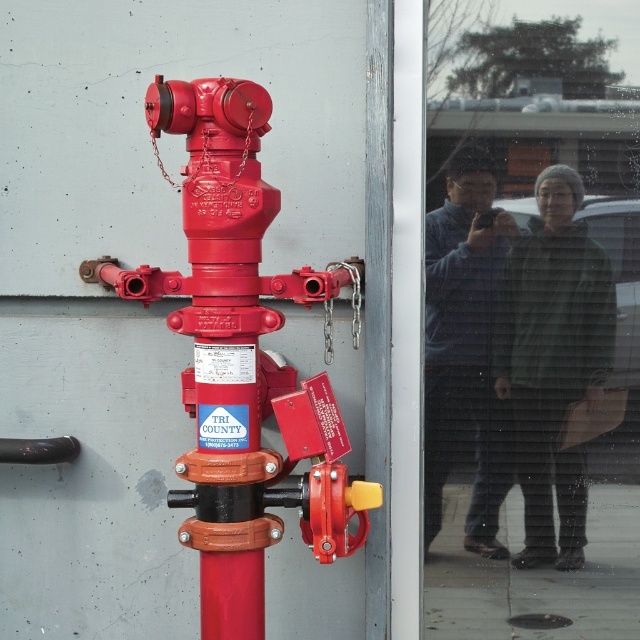
Question: Is transparent glass door at upper right below matte red fire hydrant at center?

Choices:
 (A) yes
 (B) no

Answer: (A)

Question: Which object appears farthest from the camera in this image?

Choices:
 (A) transparent glass door at upper right
 (B) matte red fire hydrant at center

Answer: (A)

Question: Which point is farther from the camera taking this photo?

Choices:
 (A) (628, 451)
 (B) (141, 268)

Answer: (A)

Question: Is transparent glass door at upper right bigger than matte red fire hydrant at center?

Choices:
 (A) yes
 (B) no

Answer: (B)

Question: Does transparent glass door at upper right come in front of matte red fire hydrant at center?

Choices:
 (A) yes
 (B) no

Answer: (B)

Question: Which point is closer to the camera taking this photo?

Choices:
 (A) (288, 410)
 (B) (454, 547)

Answer: (A)